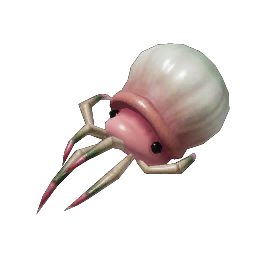
Where is `rightmost leg`? rightmost leg is located at coordinates pos(181,166).